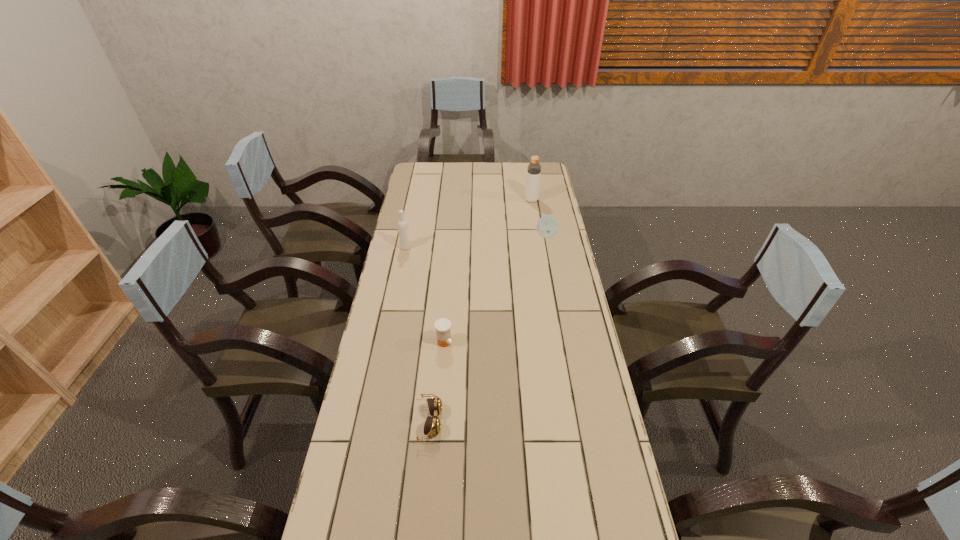
Identify the location of free space at the far right corner. (548, 180).

Find the location of a particular element. The width and height of the screenshot is (960, 540). free space that is in between the vodka and the goggles is located at coordinates (419, 334).

This screenshot has width=960, height=540. Find the location of `blank region between the goggles and the leftmost object`. blank region between the goggles and the leftmost object is located at coordinates (419, 334).

The width and height of the screenshot is (960, 540). Find the location of `free spot between the second tallest object and the tallest object`. free spot between the second tallest object and the tallest object is located at coordinates (468, 224).

Find the location of a particular element. vacant area that lies between the apple and the goggles is located at coordinates (489, 328).

I want to click on empty space between the goggles and the bottle, so click(481, 310).

This screenshot has height=540, width=960. What are the coordinates of `unoccupied position between the tallest object and the shortest object` in the screenshot? It's located at (481, 310).

Find the location of a particular element. unoccupied position between the nearest object and the leftmost object is located at coordinates (419, 334).

Point out which object is positioned as the fourth nearest to the second nearest object. Please provide its 2D coordinates. Your answer should be formatted as a tuple, i.e. [(x, y)], where the tuple contains the x and y coordinates of a point satisfying the conditions above.

[(534, 168)]

Find the location of `the fourth closest object to the bottle`. the fourth closest object to the bottle is located at coordinates (432, 426).